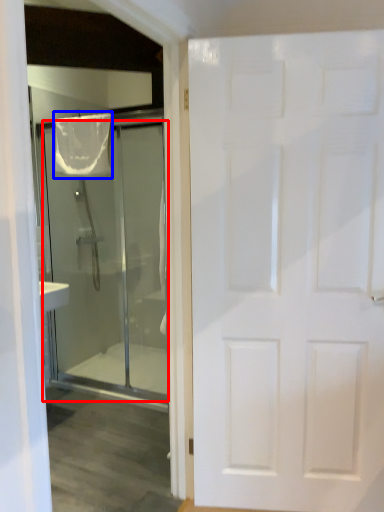
Question: Which object is further to the camera taking this photo, door (highlighted by a red box) or shower curtain (highlighted by a blue box)?

Choices:
 (A) door
 (B) shower curtain

Answer: (B)